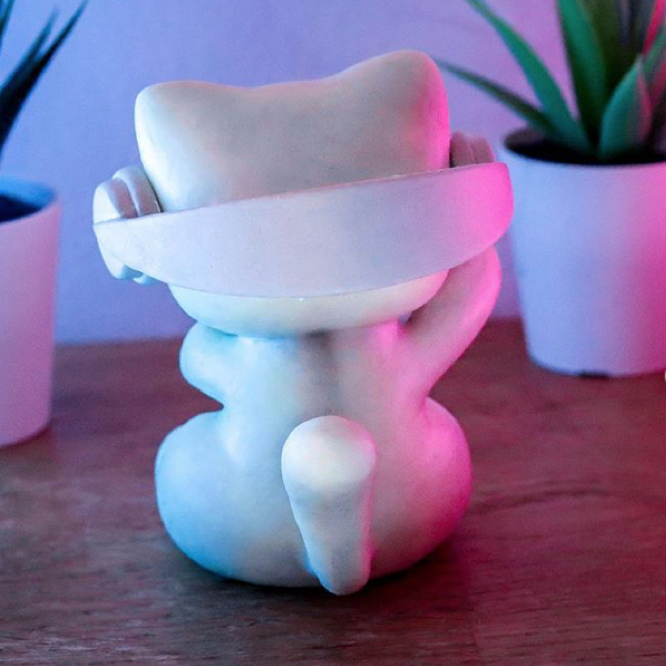
You are a GUI agent. You are given a task and a screenshot of the screen. Output one action in this format:
    pyautogui.click(x=<x>, y=<y>)
    Task: Click on the wood grain
    
    Given the screenshot: What is the action you would take?
    pyautogui.click(x=52, y=599)